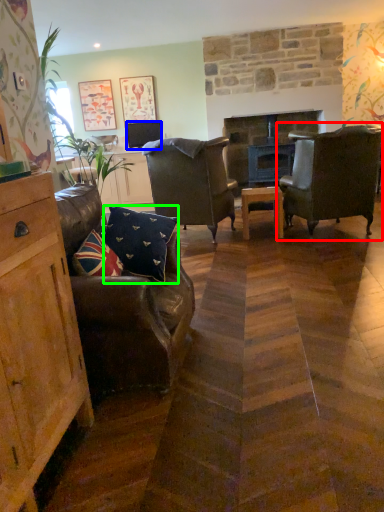
Question: Estimate the real-world distances between objects in this image. Which object is closer to chair (highlighted by a red box), television (highlighted by a blue box) or pillow (highlighted by a green box)?

Choices:
 (A) television
 (B) pillow

Answer: (B)